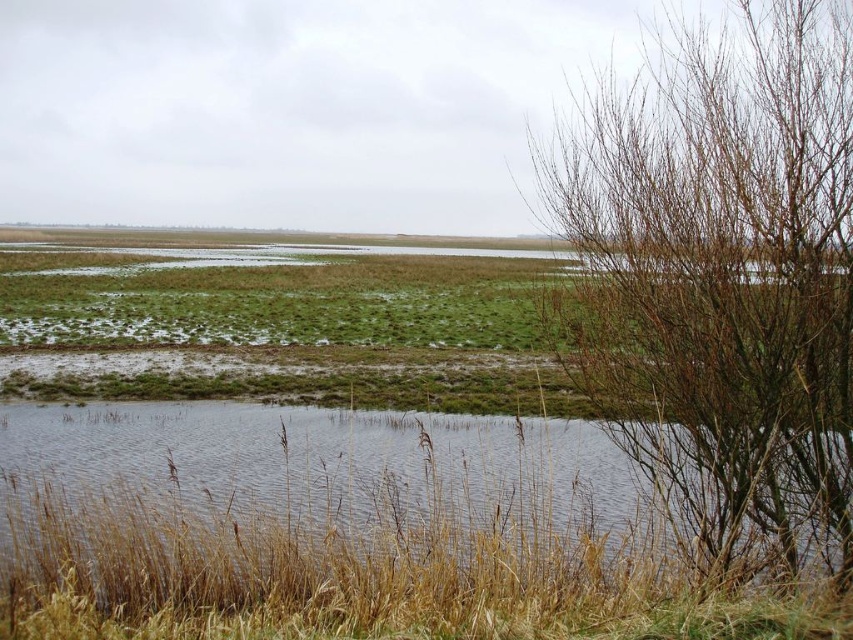
Who is positioned more to the right, brown grass at lower left or bare branches at right?

Positioned to the right is bare branches at right.

Between point (502, 458) and point (798, 330), which one is positioned in front?

Positioned in front is point (798, 330).

Does point (831, 632) come closer to viewer compared to point (805, 141)?

Yes.

Locate an element on the screen. brown grass at lower left is located at coordinates (346, 532).